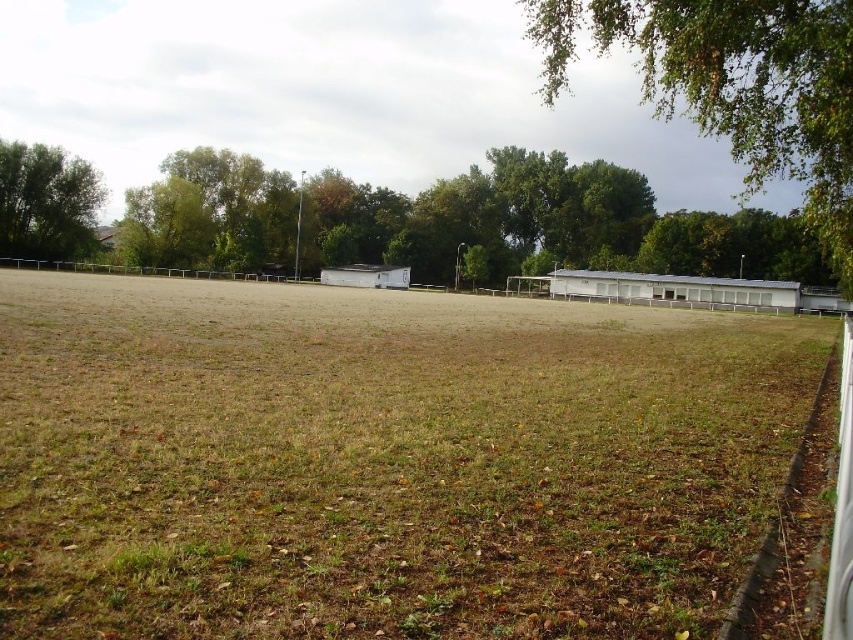
You are standing at the origin point of the coordinate system in this outdoor field scene. You want to place a new bench exactly at the coordinates where the brown grass at center is located. What are the coordinates where you should place the bench?

The coordinates for the brown grass at center are at point (381, 460), so you should place the bench at those coordinates.

You are standing at the origin point of the coordinate system in this image. You want to walk to the brown grass at center. Which direction should you move in to reach it?

The brown grass at center is located at coordinate point 0.720 in the x direction and 0.449 in the y direction. Since you are at the origin, you should move towards the positive x and positive y directions to reach the brown grass at center.